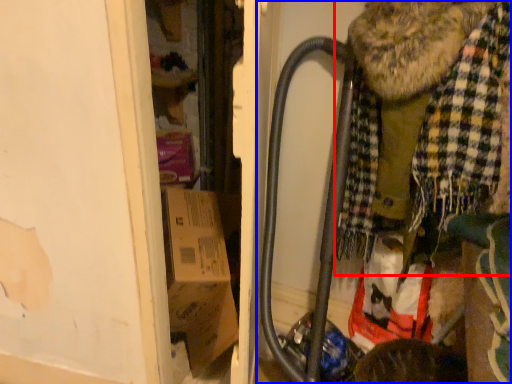
Question: Which of the following is the closest to the observer, scarf (highlighted by a red box) or baby carriage (highlighted by a blue box)?

Choices:
 (A) scarf
 (B) baby carriage

Answer: (A)